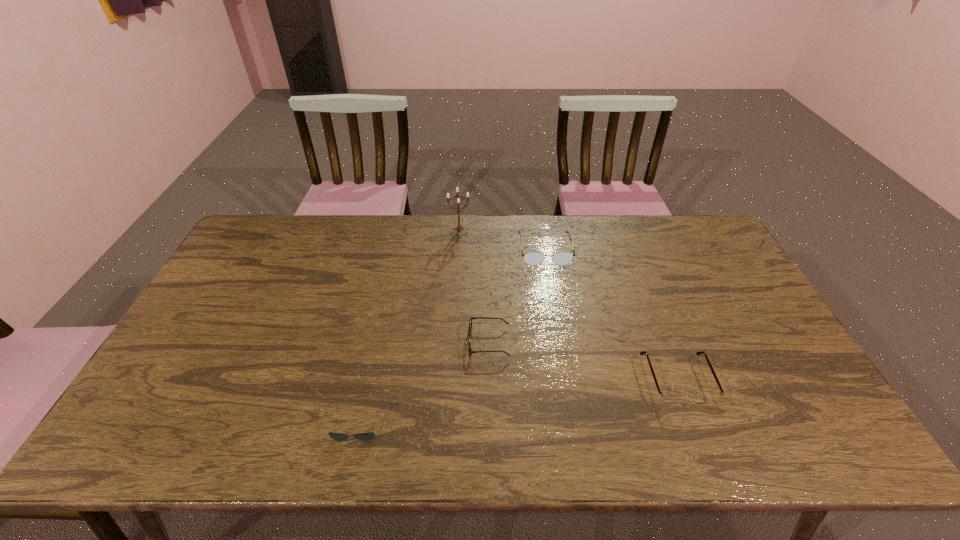
Identify the location of free space that is in between the leftmost object and the candle holder. This screenshot has height=540, width=960. (409, 328).

At what (x,y) coordinates should I click in order to perform the action: click on free spot between the rightmost spectacles and the second spectacles from left to right. Please return your answer as a coordinate pair (x, y). The image size is (960, 540). Looking at the image, I should click on (611, 315).

The width and height of the screenshot is (960, 540). Identify the location of vacant region between the sunglasses and the farthest spectacles. (451, 336).

In order to click on free space between the rightmost spectacles and the leftmost spectacles in this screenshot , I will do `click(583, 361)`.

This screenshot has height=540, width=960. I want to click on vacant area between the shortest spectacles and the sunglasses, so click(423, 382).

I want to click on vacant area between the farthest spectacles and the rightmost spectacles, so click(611, 315).

What are the coordinates of `vacant space that is in between the tallest object and the shortest spectacles` in the screenshot? It's located at (474, 288).

Locate an element on the screen. This screenshot has height=540, width=960. free space between the shortest spectacles and the fourth object from left to right is located at coordinates (516, 296).

Locate an element on the screen. The image size is (960, 540). vacant region between the second spectacles from right to left and the candle holder is located at coordinates (502, 241).

This screenshot has width=960, height=540. I want to click on the third closest object to the rightmost spectacles, so click(368, 436).